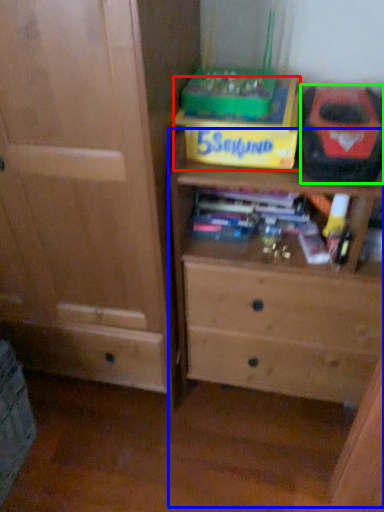
Question: Which object is positioned farthest from cardboard box (highlighted by a red box)? Select from chest of drawers (highlighted by a blue box) and kit (highlighted by a green box).

Choices:
 (A) chest of drawers
 (B) kit

Answer: (A)